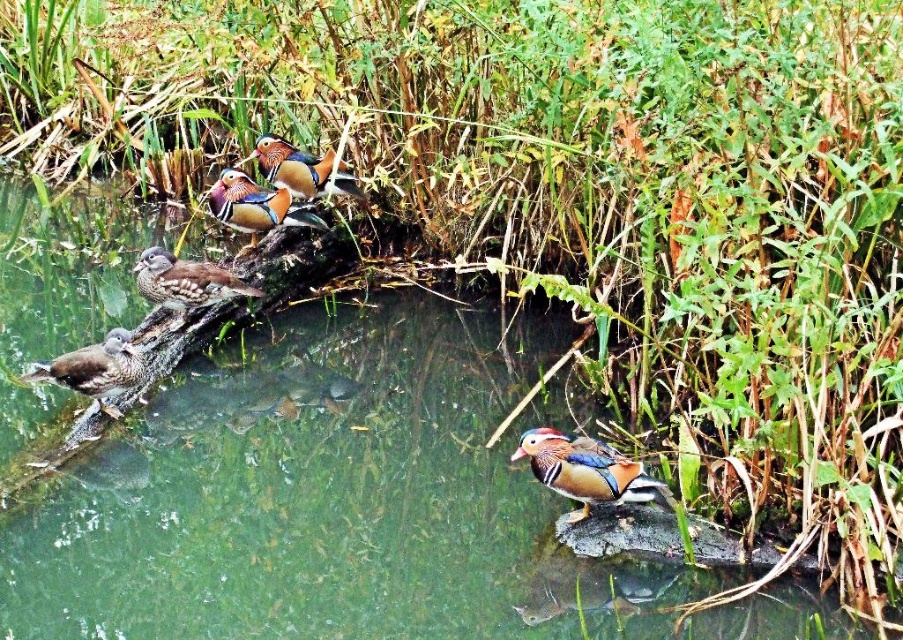
Question: Can you confirm if multicolored glossy duck at upper center is wider than shiny orange duck at upper center?

Choices:
 (A) no
 (B) yes

Answer: (B)

Question: Which object is closer to the camera taking this photo?

Choices:
 (A) shiny multicolored duck at center
 (B) multicolored glossy duck at upper center
 (C) brown speckled duck at upper left
 (D) brown matte duck at lower left

Answer: (A)

Question: Is shiny multicolored duck at center closer to camera compared to multicolored glossy duck at upper center?

Choices:
 (A) yes
 (B) no

Answer: (A)

Question: In this image, where is shiny multicolored duck at center located relative to brown matte duck at lower left?

Choices:
 (A) below
 (B) above

Answer: (A)

Question: Which object is closer to the camera taking this photo?

Choices:
 (A) shiny multicolored duck at center
 (B) brown speckled duck at upper left

Answer: (A)

Question: Which of the following is the farthest from the observer?

Choices:
 (A) multicolored glossy duck at upper center
 (B) shiny orange duck at upper center
 (C) brown matte duck at lower left
 (D) brown speckled duck at upper left

Answer: (B)